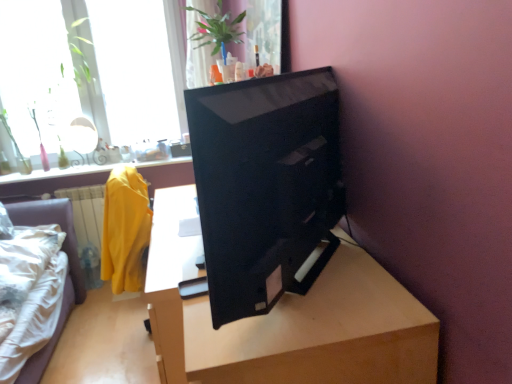
Question: From a real-world perspective, relative to transparent glass window at upper left, which is counted as the second window, starting from the left, is light brown wood table at center vertically above or below?

Choices:
 (A) below
 (B) above

Answer: (A)

Question: Is light brown wood table at center wider or thinner than transparent glass window at upper left, which is counted as the second window, starting from the left?

Choices:
 (A) thin
 (B) wide

Answer: (B)

Question: Estimate the real-world distances between objects in this image. Which object is farther from the black glossy monitor at center?

Choices:
 (A) transparent glass window at upper left, which appears as the 1th window when viewed from the left
 (B) white fabric bed at lower left
 (C) transparent glass window at upper left, positioned as the 1th window in right-to-left order
 (D) light brown wood table at center

Answer: (A)

Question: Estimate the real-world distances between objects in this image. Which object is closer to the black glossy monitor at center?

Choices:
 (A) white fabric bed at lower left
 (B) light brown wood table at center
 (C) transparent glass window at upper left, which is counted as the second window, starting from the left
 (D) transparent glass window at upper left, which is the second window in right-to-left order

Answer: (B)